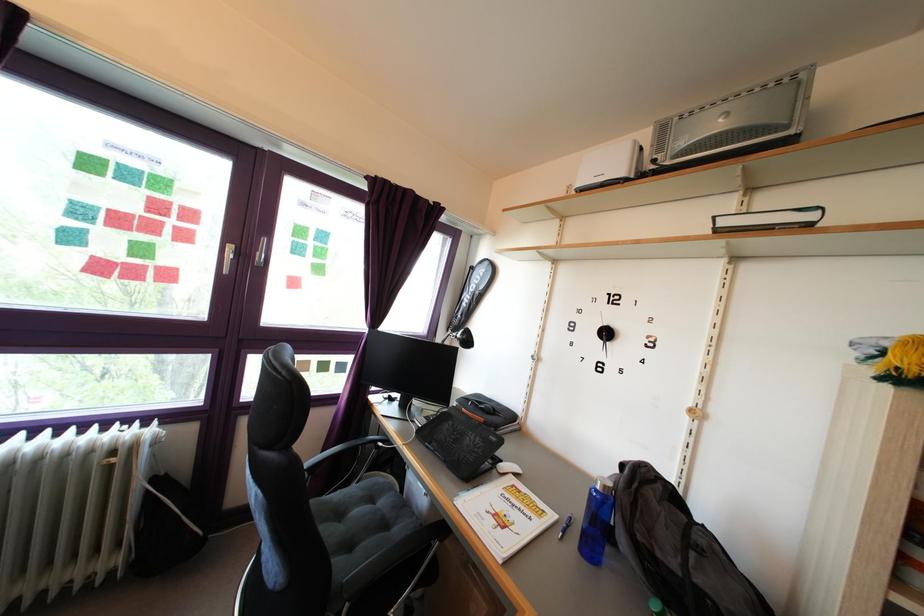
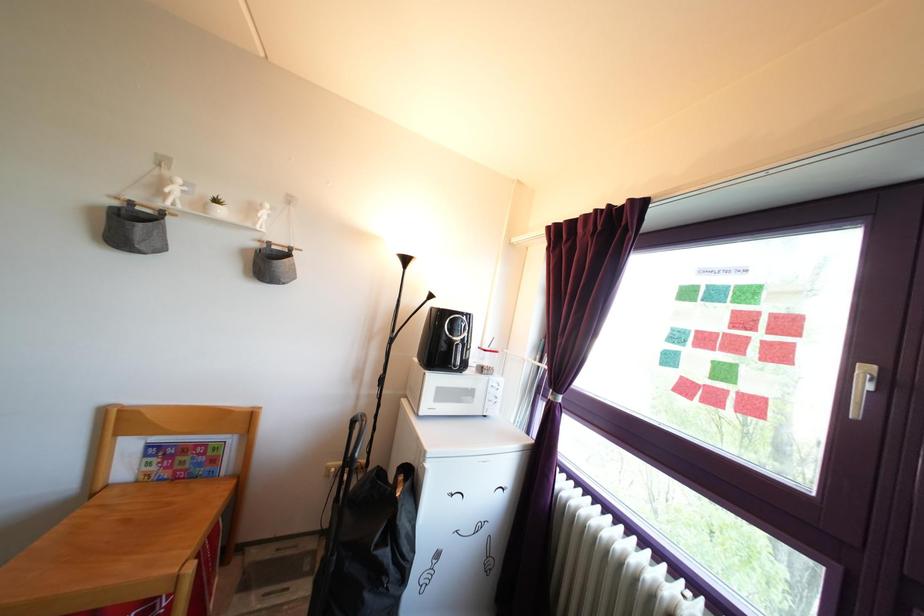
Question: The camera is either moving clockwise (left) or counter-clockwise (right) around the object. The first image is from the beginning of the video and the second image is from the end. Is the camera moving left or right when shooting the video?

Choices:
 (A) Left
 (B) Right

Answer: (B)